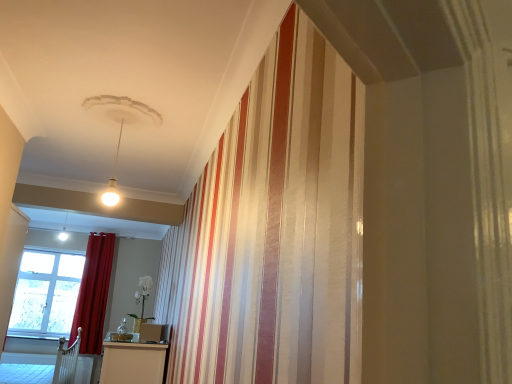
Question: From a real-world perspective, is clear glass window at lower left located higher than velvet red curtain at left?

Choices:
 (A) yes
 (B) no

Answer: (B)

Question: Can you confirm if clear glass window at lower left is shorter than velvet red curtain at left?

Choices:
 (A) no
 (B) yes

Answer: (B)

Question: Considering the relative sizes of clear glass window at lower left and velvet red curtain at left in the image provided, is clear glass window at lower left smaller than velvet red curtain at left?

Choices:
 (A) no
 (B) yes

Answer: (B)

Question: Is clear glass window at lower left further to the viewer compared to velvet red curtain at left?

Choices:
 (A) no
 (B) yes

Answer: (B)

Question: Is clear glass window at lower left facing away from velvet red curtain at left?

Choices:
 (A) yes
 (B) no

Answer: (B)

Question: From the image's perspective, is clear glass window at lower left above velvet red curtain at left?

Choices:
 (A) yes
 (B) no

Answer: (B)

Question: Can we say velvet red curtain at left lies outside clear glass window at lower left?

Choices:
 (A) no
 (B) yes

Answer: (B)

Question: From the image's perspective, is velvet red curtain at left beneath clear glass window at lower left?

Choices:
 (A) no
 (B) yes

Answer: (A)

Question: Is velvet red curtain at left positioned with its back to clear glass window at lower left?

Choices:
 (A) no
 (B) yes

Answer: (A)

Question: Is velvet red curtain at left wider than clear glass window at lower left?

Choices:
 (A) yes
 (B) no

Answer: (A)

Question: Is velvet red curtain at left far from clear glass window at lower left?

Choices:
 (A) no
 (B) yes

Answer: (A)

Question: Is velvet red curtain at left to the left of clear glass window at lower left from the viewer's perspective?

Choices:
 (A) yes
 (B) no

Answer: (B)

Question: In terms of size, does velvet red curtain at left appear bigger or smaller than clear glass window at lower left?

Choices:
 (A) small
 (B) big

Answer: (B)